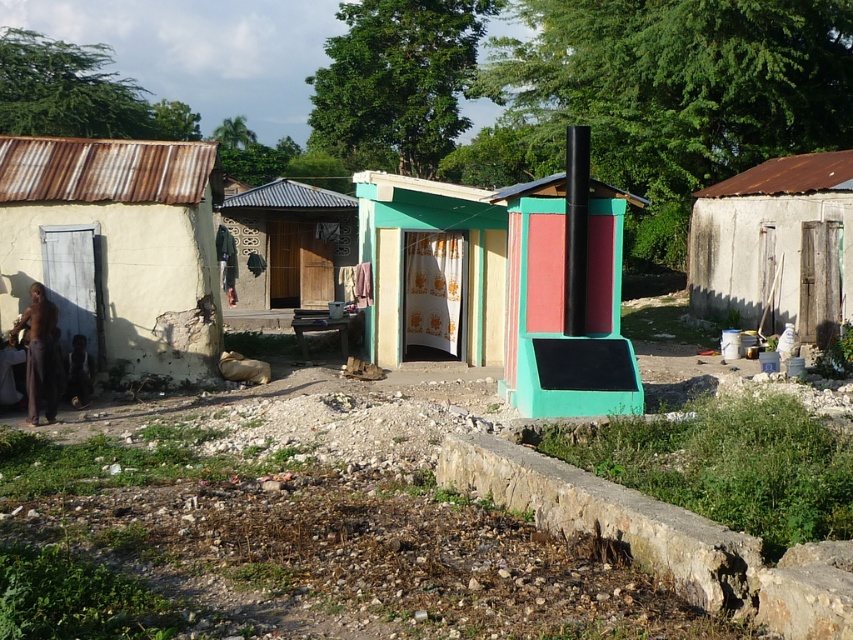
You are a delivery person who needs to park your truck, which is 2 meters wide, near the rusty metal hut at right and the green painted wood door at center. Based on the spatial arrangement, can your truck fit between them without overlapping?

The rusty metal hut at right might be wider than the green painted wood door at center, so there might not be enough space for the truck to fit between them. It is uncertain and risky to attempt parking there.

You are a delivery person trying to reach the green painted wood door at center. There is a rusty metal hut at right nearby. Which structure should you avoid to prevent blocking your delivery path?

You should avoid the rusty metal hut at right because it is taller than the green painted wood door at center, which might block your path if you place items near it.